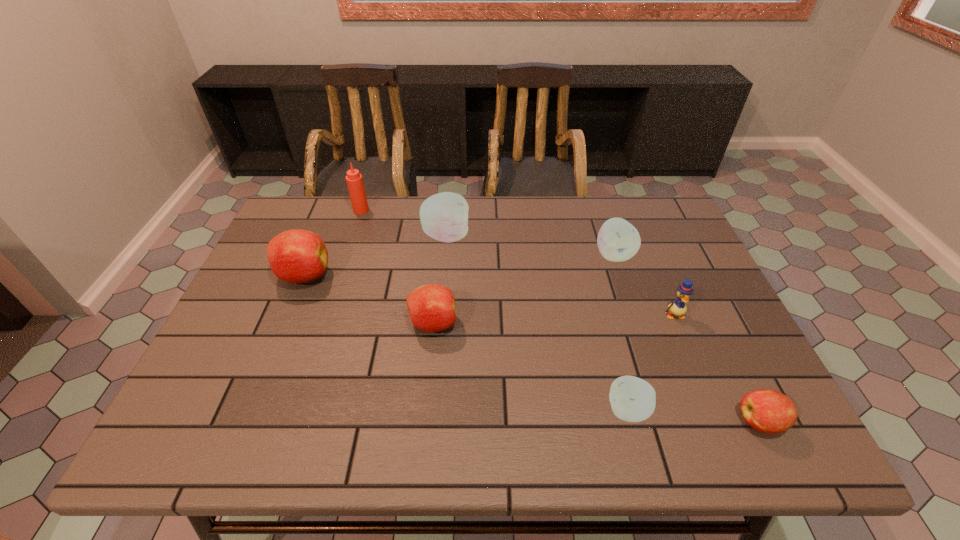
The image size is (960, 540). Identify the location of the nearest red apple. (768, 411).

Locate an element on the screen. the smallest red apple is located at coordinates (768, 411).

Locate an element on the screen. This screenshot has width=960, height=540. vacant space situated on the front of the farthest object is located at coordinates (332, 298).

Locate an element on the screen. vacant area situated 0.050m on the back of the leftmost white apple is located at coordinates (448, 212).

Identify the location of free space located on the right of the leftmost apple. This screenshot has height=540, width=960. (349, 276).

The height and width of the screenshot is (540, 960). Find the location of `vacant area situated 0.090m on the front of the second biggest white apple`. vacant area situated 0.090m on the front of the second biggest white apple is located at coordinates (626, 291).

Find the location of a particular element. vacant area situated on the face of the yellow duckling, where the monocle is placed is located at coordinates (686, 344).

This screenshot has width=960, height=540. Find the location of `free location located 0.090m on the back of the third nearest apple`. free location located 0.090m on the back of the third nearest apple is located at coordinates (437, 282).

Where is `vacant space located 0.370m on the back of the nearest white apple`? vacant space located 0.370m on the back of the nearest white apple is located at coordinates pos(592,274).

The image size is (960, 540). Find the location of `vacant space located on the left of the rightmost red apple`. vacant space located on the left of the rightmost red apple is located at coordinates (588, 422).